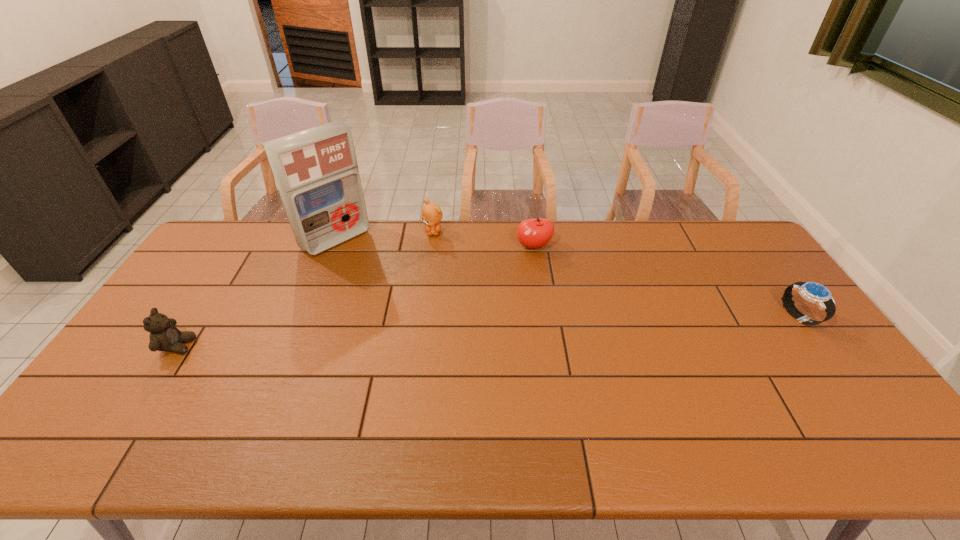
The width and height of the screenshot is (960, 540). Find the location of `vacant space on the desktop that is between the nearer teddy bear and the shortest object and is positioned on the stem of the apple`. vacant space on the desktop that is between the nearer teddy bear and the shortest object and is positioned on the stem of the apple is located at coordinates (553, 328).

Identify the location of vacant space on the desktop that is between the nearer teddy bear and the watch and is positioned on the face of the right teddy bear. (423, 335).

The image size is (960, 540). In order to click on free spot on the desktop that is between the leftmost object and the rightmost object and is positioned on the front-facing side of the first-aid kit in this screenshot , I will do `click(442, 334)`.